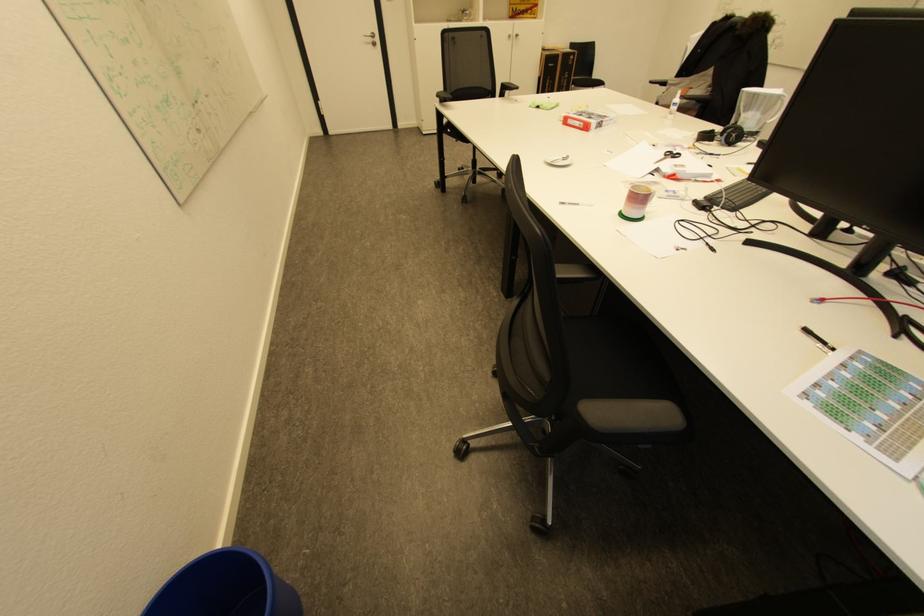
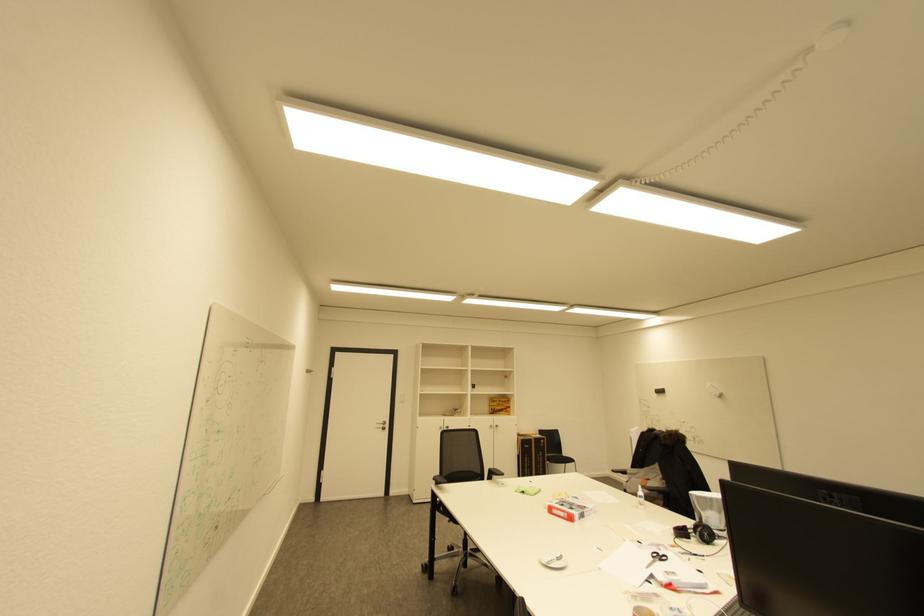
Locate, in the second image, the point that corresponds to [500,95] in the first image.

(488, 479)